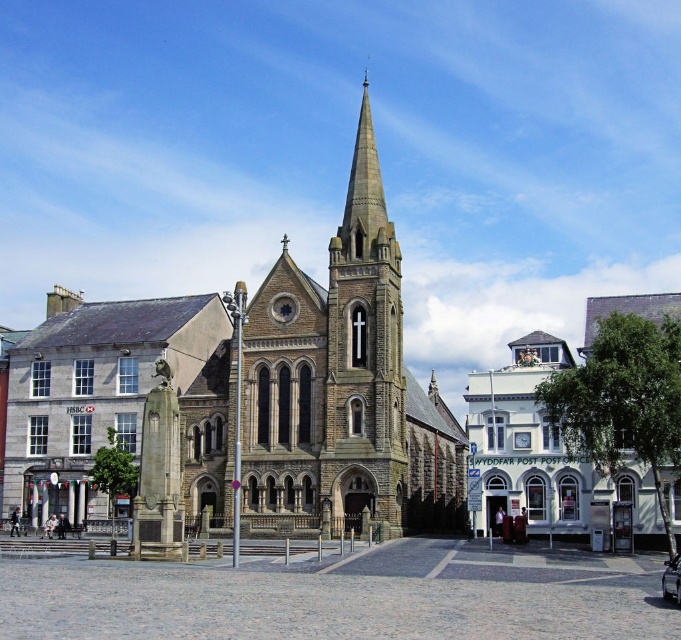
Question: In this image, where is brown stone church at center located relative to dark gray stone tower at center?

Choices:
 (A) above
 (B) below

Answer: (B)

Question: Which of the following is the closest to the observer?

Choices:
 (A) dark gray stone tower at center
 (B) brown stone church at center

Answer: (B)

Question: Among these objects, which one is nearest to the camera?

Choices:
 (A) dark gray stone tower at center
 (B) brown stone church at center

Answer: (B)

Question: Does brown stone church at center appear over dark gray stone tower at center?

Choices:
 (A) no
 (B) yes

Answer: (A)

Question: Is brown stone church at center below dark gray stone tower at center?

Choices:
 (A) yes
 (B) no

Answer: (A)